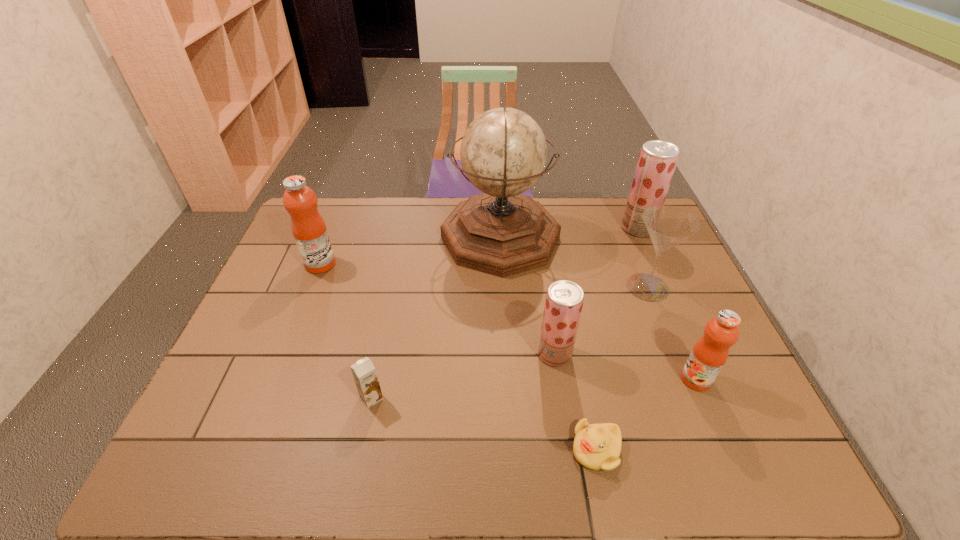
You are a GUI agent. You are given a task and a screenshot of the screen. Output one action in this format:
    pyautogui.click(x=<x>, y=<y>)
    Task: Click on the vacant space located 0.340m on the left of the second fruit juice from left to right
    
    Given the screenshot: What is the action you would take?
    pyautogui.click(x=405, y=354)

Locate an element on the screen. This screenshot has height=540, width=960. blank area located on the front label of the right orange fruit juice is located at coordinates (545, 379).

Locate an element on the screen. The image size is (960, 540). free region located 0.150m on the front label of the right orange fruit juice is located at coordinates (619, 379).

This screenshot has height=540, width=960. I want to click on free space located 0.060m on the front label of the right orange fruit juice, so click(657, 379).

Image resolution: width=960 pixels, height=540 pixels. Identify the location of vacant space located 0.230m on the left of the chocolate milk. (261, 397).

I want to click on free space located on the front-facing side of the shortest object, so click(507, 450).

Where is `vacant space positioned 0.060m on the front-facing side of the shortest object`? The width and height of the screenshot is (960, 540). vacant space positioned 0.060m on the front-facing side of the shortest object is located at coordinates pyautogui.click(x=544, y=450).

Image resolution: width=960 pixels, height=540 pixels. I want to click on vacant space located 0.240m on the front-facing side of the shortest object, so click(x=460, y=450).

Find the location of a particular element. globe present at the far edge is located at coordinates (501, 232).

At what (x,y) coordinates should I click in order to perform the action: click on fruit juice positioned at the far edge. Please return your answer as a coordinate pair (x, y). Looking at the image, I should click on (657, 160).